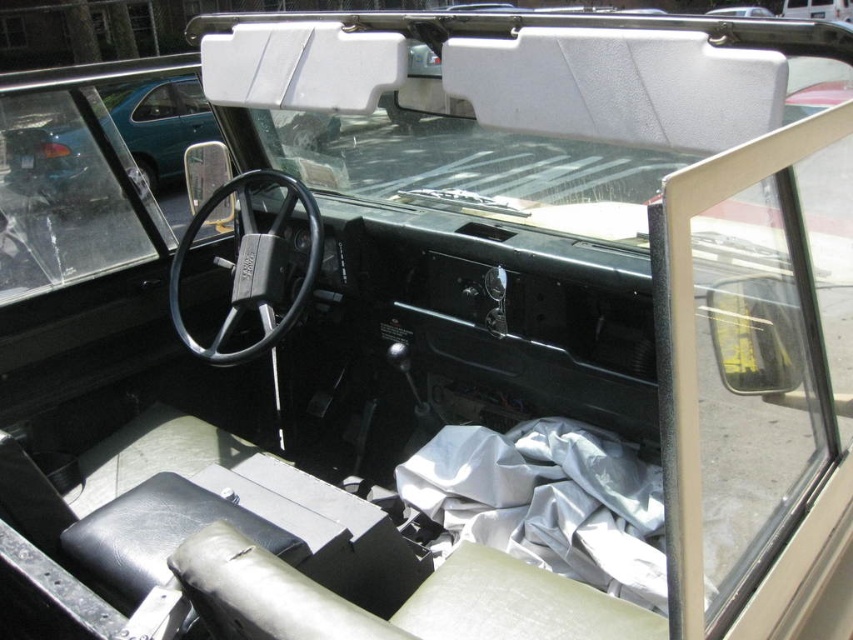
You are sitting in the driver seat of the vintage vehicle and want to know the exact coordinates of the white matte windshield at center. What are its coordinates?

The white matte windshield at center is located at coordinates point (x=520, y=100).

You are sitting in the driver seat of the vintage Jeep. You notice two white items at the center of your view. Which one is closer to you, the white matte windshield at center or the white fabric at center?

The white matte windshield at center is closer to the viewer than the white fabric at center.

You are a passenger sitting in the back seat of the vintage Jeep. You want to hand a map to the driver who is sitting in the front seat. The map is 12 inches long. Can you reach the driver by extending your arm through the space between you and the white matte windshield at center?

The distance of white matte windshield at center from camera is 30.18 inches. Since the map is 12 inches long, and the distance between you and the windshield is over 30 inches, you would not be able to reach the driver by extending your arm through the space between you and the white matte windshield at center.